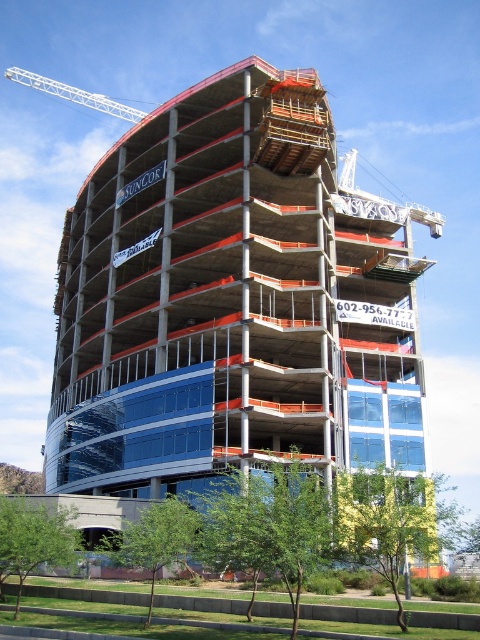
You are a construction worker standing at the base of the building. You notice two points marked on the construction blueprint. The first point is at coordinate point (351, 346) and the second is at point (59, 90). Which point is closer to you?

Point (351, 346) is in front of point (59, 90), so the point closer to you is point (351, 346).

You are an architect observing the construction site. You notice the concrete building at center and the white metal crane at upper left. Which structure is taller?

The concrete building at center is taller than the white metal crane at upper left according to the description.

You are a construction worker standing at the entrance of the construction site. You need to move a heavy beam from the white metal crane at upper left to the concrete building at center. Which direction should you move the beam to place it correctly?

The concrete building at center is positioned on the right side of the white metal crane at upper left, so you should move the beam to the right to place it correctly.